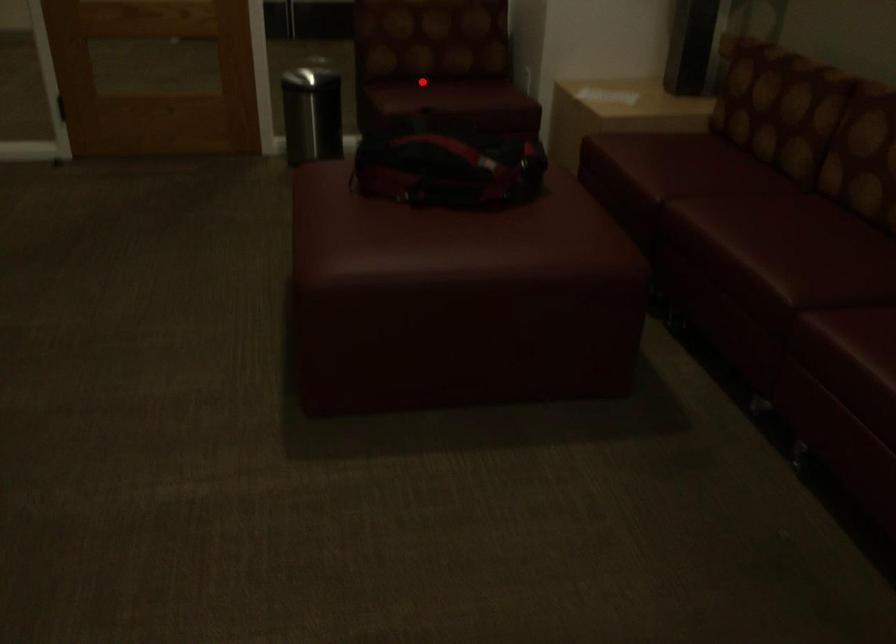
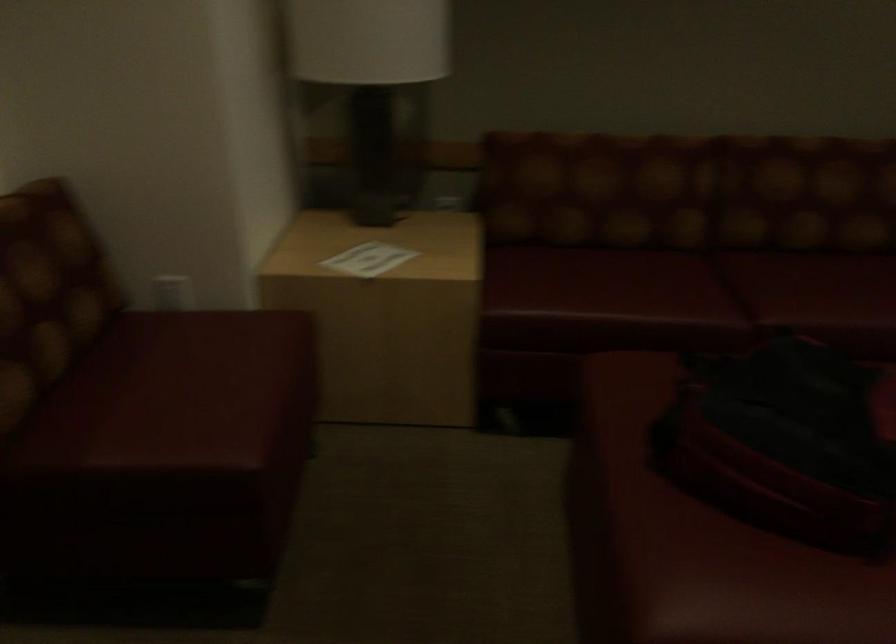
Question: I am providing you with two images of the same scene from different viewpoints. Image1 has a red point marked. In image2, the corresponding 3D location appears at what relative position? Reply with the corresponding letter.

Choices:
 (A) Closer
 (B) Farther

Answer: (A)